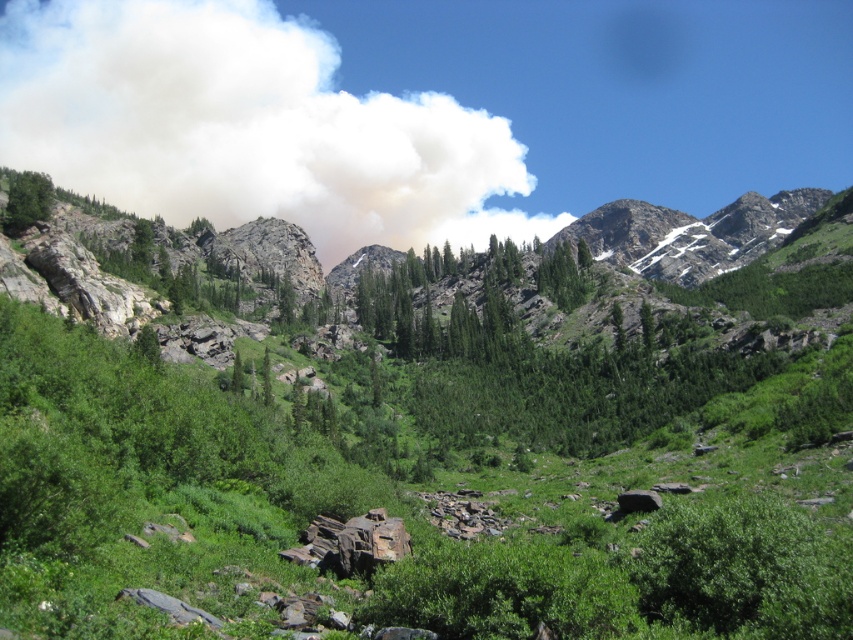
Between point (305, 134) and point (16, 205), which one is positioned in front?

Point (16, 205) is more forward.

Is white smoke at upper center below green matte tree at upper left?

No, white smoke at upper center is not below green matte tree at upper left.

Does point (173, 147) come behind point (30, 195)?

That is True.

This screenshot has width=853, height=640. What are the coordinates of `white smoke at upper center` in the screenshot? It's located at (247, 128).